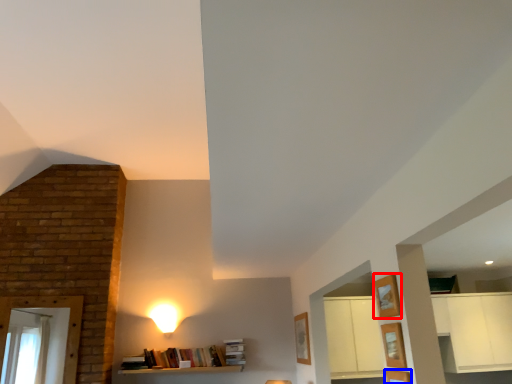
Question: Among these objects, which one is farthest to the camera, shelf (highlighted by a red box) or shelf (highlighted by a blue box)?

Choices:
 (A) shelf
 (B) shelf

Answer: (A)